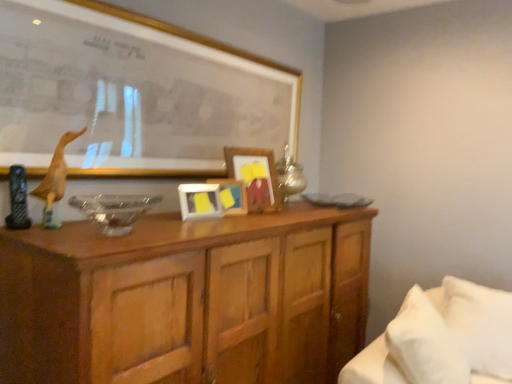
At what (x,y) coordinates should I click in order to perform the action: click on empty space that is ontop of matte gold picture frame at upper center, positioned as the 4th picture frame in back-to-front order. Please return your answer as a coordinate pair (x, y). Looking at the image, I should click on (210, 30).